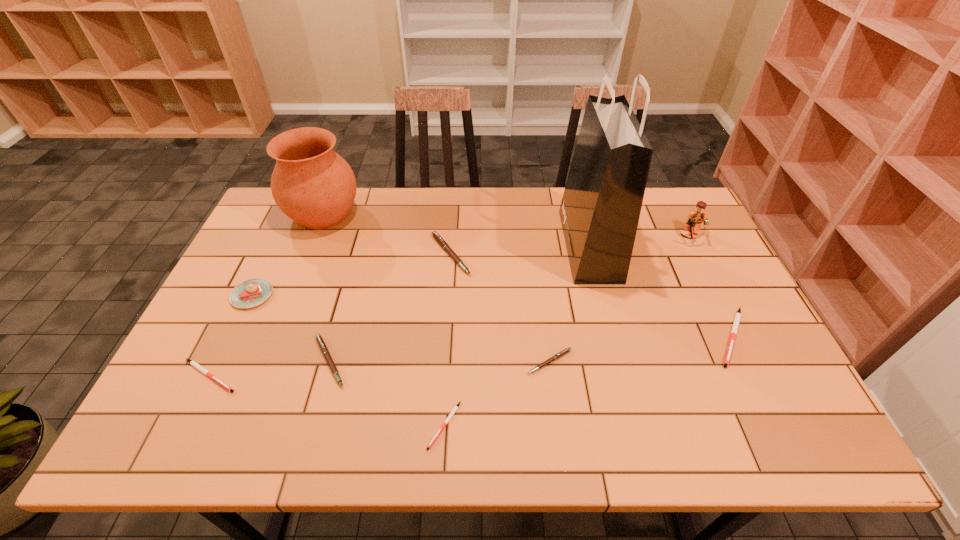
This screenshot has width=960, height=540. What are the coordinates of `the rightmost pen` in the screenshot? It's located at (738, 315).

This screenshot has height=540, width=960. I want to click on the fifth pen from left to right, so click(563, 352).

Locate an element on the screen. the smallest pink pen is located at coordinates (563, 352).

This screenshot has width=960, height=540. Identify the location of the second biggest white pen. click(193, 363).

Where is `the leftmost white pen`? This screenshot has height=540, width=960. the leftmost white pen is located at coordinates (193, 363).

Identify the location of the smallest white pen. The width and height of the screenshot is (960, 540). (451, 414).

You are a GUI agent. You are given a task and a screenshot of the screen. Output one action in this format:
    pyautogui.click(x=<x>, y=<y>)
    Task: Click on the nearest object
    Image resolution: width=960 pixels, height=540 pixels.
    Given the screenshot: What is the action you would take?
    pyautogui.click(x=451, y=414)

Where is `free space located on the front with handles of the eighth object from left to right`? free space located on the front with handles of the eighth object from left to right is located at coordinates (487, 245).

Locate an element on the screen. free region located on the front with handles of the eighth object from left to right is located at coordinates (506, 245).

Image resolution: width=960 pixels, height=540 pixels. Identify the location of vacant position located 0.070m on the front with handles of the eighth object from left to right. (543, 245).